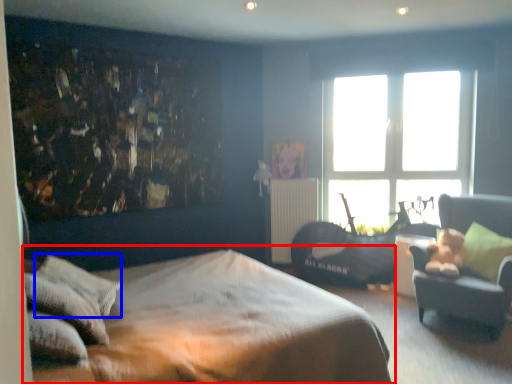
Question: Which object appears closest to the camera in this image, bed (highlighted by a red box) or pillow (highlighted by a blue box)?

Choices:
 (A) bed
 (B) pillow

Answer: (A)